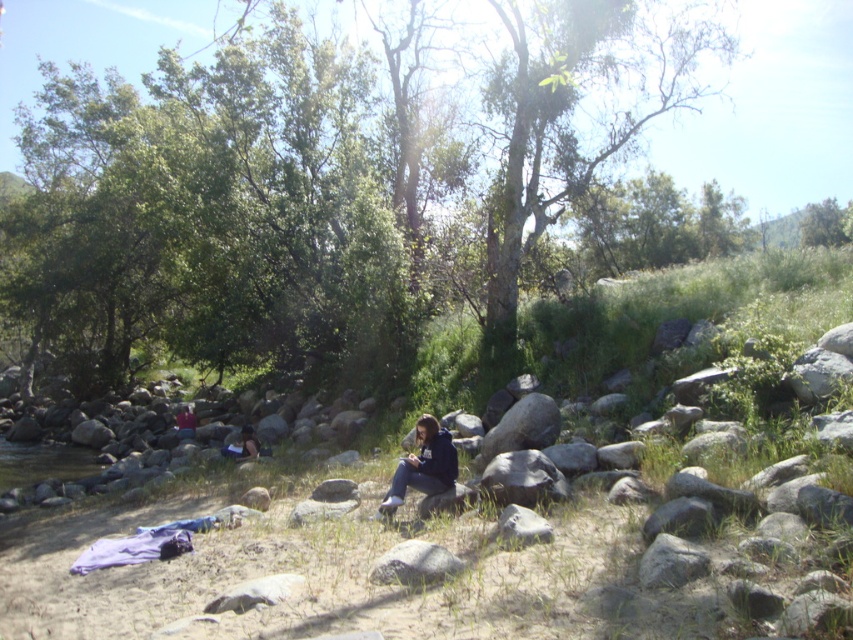
Looking at this image, does dark blue hoodie at center appear on the right side of gray rough rock at center?

No, dark blue hoodie at center is not to the right of gray rough rock at center.

Is dark blue hoodie at center wider than gray rough rock at center?

No.

Is point (424, 481) farther from camera compared to point (485, 458)?

No, it is not.

Where is `dark blue hoodie at center`? Image resolution: width=853 pixels, height=640 pixels. dark blue hoodie at center is located at coordinates (422, 465).

Does smooth gray rock at center have a smaller size compared to green leafy tree at upper right?

Yes, smooth gray rock at center is smaller than green leafy tree at upper right.

Is smooth gray rock at center positioned in front of green leafy tree at upper right?

Yes, it is in front of green leafy tree at upper right.

Which is in front, point (432, 566) or point (822, 208)?

Positioned in front is point (432, 566).

The height and width of the screenshot is (640, 853). I want to click on smooth gray rock at center, so click(x=415, y=564).

Does point (836, 234) come farther from viewer compared to point (178, 428)?

Yes, point (836, 234) is behind point (178, 428).

The image size is (853, 640). Describe the element at coordinates (827, 224) in the screenshot. I see `green leafy tree at upper right` at that location.

Image resolution: width=853 pixels, height=640 pixels. What are the coordinates of `green leafy tree at upper right` in the screenshot? It's located at (827, 224).